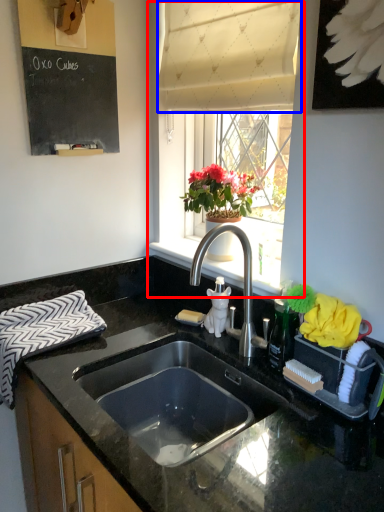
Question: Which object appears closest to the camera in this image, window (highlighted by a red box) or curtain (highlighted by a blue box)?

Choices:
 (A) window
 (B) curtain

Answer: (A)